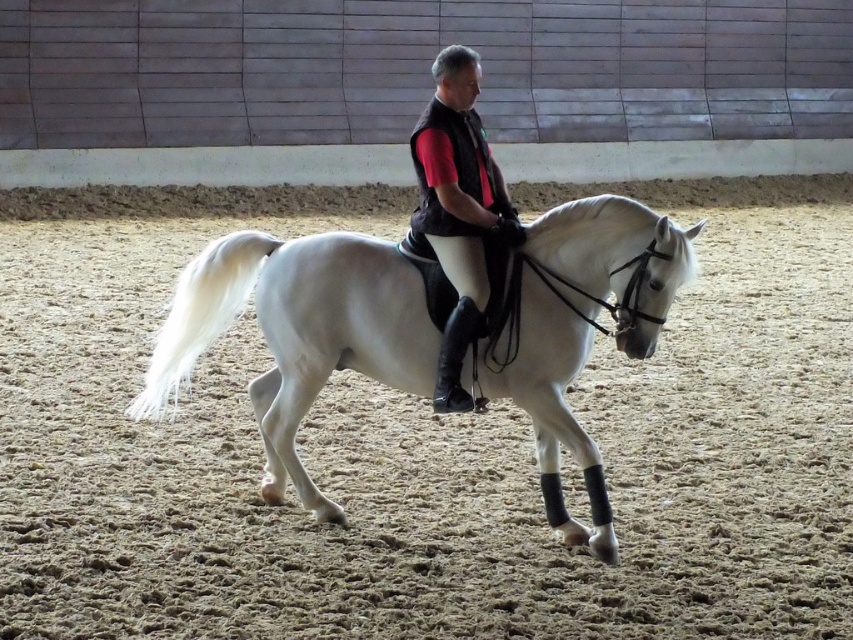
Question: Which of the following is the farthest from the observer?

Choices:
 (A) (483, 253)
 (B) (180, 353)

Answer: (B)

Question: Which point is closer to the camera?

Choices:
 (A) white glossy horse at center
 (B) black matte vest at center

Answer: (A)

Question: Can you confirm if white glossy horse at center is thinner than black matte vest at center?

Choices:
 (A) yes
 (B) no

Answer: (B)

Question: Can you confirm if white glossy horse at center is wider than black matte vest at center?

Choices:
 (A) no
 (B) yes

Answer: (B)

Question: Does white glossy horse at center have a greater width compared to black matte vest at center?

Choices:
 (A) no
 (B) yes

Answer: (B)